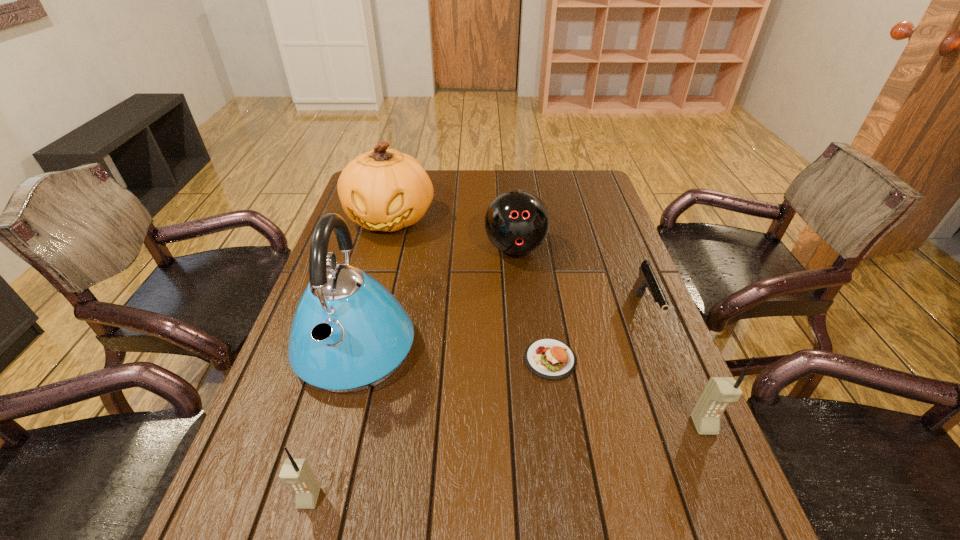
You are a GUI agent. You are given a task and a screenshot of the screen. Output one action in this format:
    pyautogui.click(x=<x>, y=<y>)
    Task: Click on the shorter cellular telephone
    This screenshot has width=960, height=540.
    Given the screenshot: What is the action you would take?
    pyautogui.click(x=297, y=472)

Identify the location of the nearer cellular telephone. (297, 472).

Identify the location of the second nearest object. (720, 391).

Identify the location of the taller cellular telephone. (720, 391).

At what (x,y) coordinates should I click in order to perform the action: click on bowling ball. Please return your answer as a coordinate pair (x, y). Looking at the image, I should click on (517, 222).

The width and height of the screenshot is (960, 540). I want to click on the sixth shortest object, so click(381, 190).

At what (x,y) coordinates should I click in order to perform the action: click on the shortest object. Please return your answer as a coordinate pair (x, y). The width and height of the screenshot is (960, 540). Looking at the image, I should click on (552, 359).

Locate an element on the screen. kettle is located at coordinates (349, 333).

Identify the location of pistol. This screenshot has height=540, width=960. (647, 280).

In order to click on vacant space situated on the front of the right cellular telephone, where the keypad is located in this screenshot , I will do click(x=718, y=460).